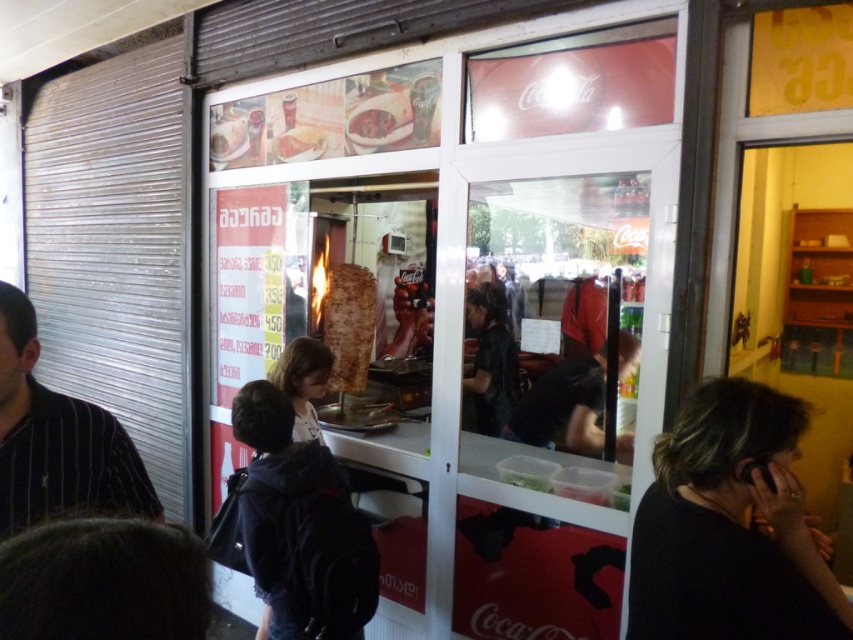
You are a delivery person standing at the entrance of the street food stall. You need to quickly grab a black fabric at right and a black striped shirt at left to cover some items. Can you reach both items without moving more than 1 meter from your current position?

The black fabric at right is 1.10 meters away from the black striped shirt at left. Since the distance between them is more than 1 meter, you cannot reach both items without moving more than 1 meter from your current position.

You are a customer standing in front of the street food stall. You want to order a doner kebab. Which object should you approach first, the transparent glass door at center or the dark brown hair at lower left?

You should approach the transparent glass door at center first because it is located below the dark brown hair at lower left, meaning the door is closer to you than the dark brown hair at lower left.